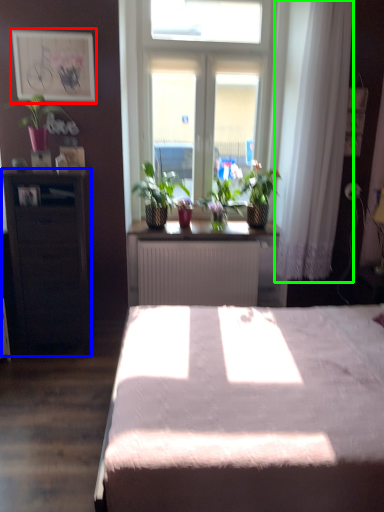
Question: Considering the real-world distances, which object is closest to picture frame (highlighted by a red box)? table (highlighted by a blue box) or curtain (highlighted by a green box).

Choices:
 (A) table
 (B) curtain

Answer: (A)